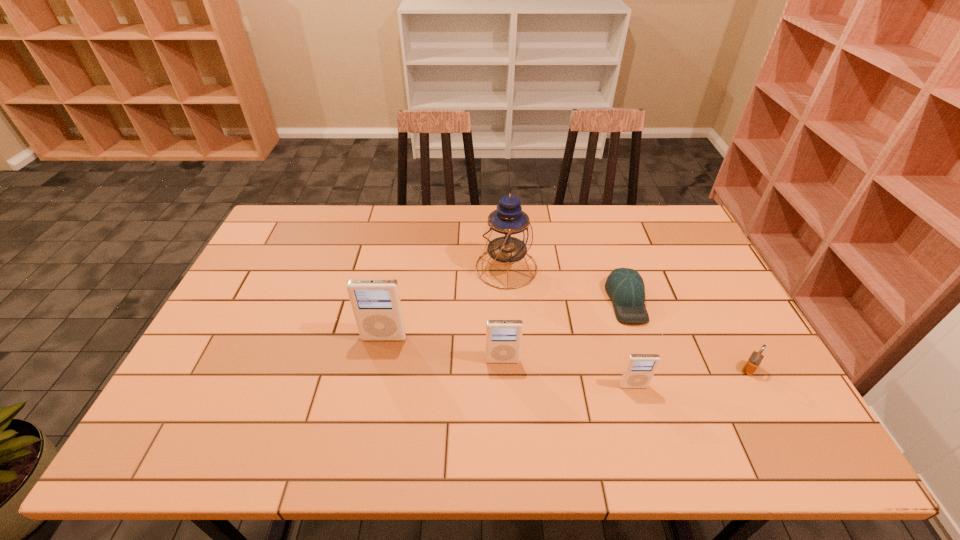
In the current image, all iPods are evenly spaced. To maintain this equal spacing, where should an additional iPod be placed on the left? Please point out a free spot. Please provide its 2D coordinates. Your answer should be formatted as a tuple, i.e. [(x, y)], where the tuple contains the x and y coordinates of a point satisfying the conditions above.

[(276, 317)]